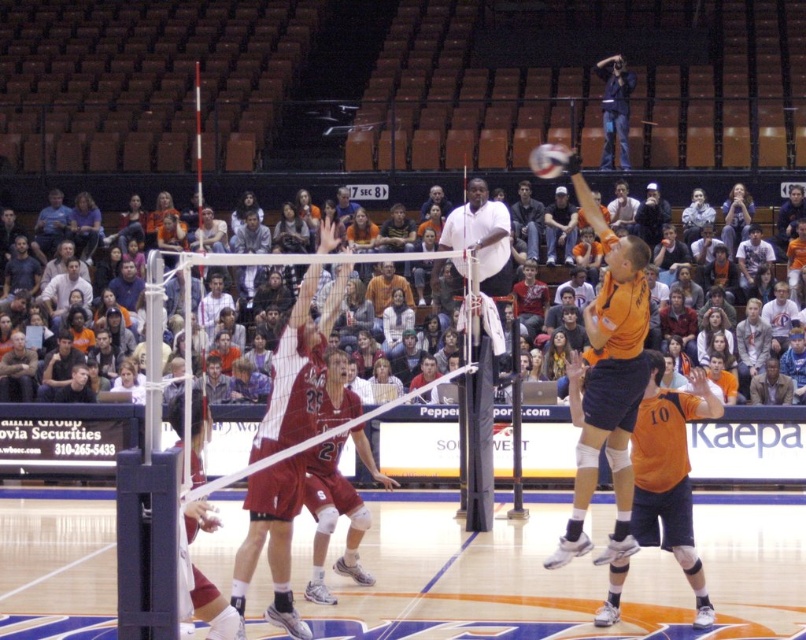
Is orange uniformed player at center further to camera compared to white matte volleyball at center?

Yes, it is.

Is orange uniformed player at center closer to the viewer compared to white matte volleyball at center?

No, it is behind white matte volleyball at center.

Identify the location of orange uniformed player at center. This screenshot has height=640, width=806. (559, 577).

Is orange casual clothing at upper center positioned before white matte volleyball at center?

That is False.

Is orange casual clothing at upper center positioned at the back of white matte volleyball at center?

Yes.

Between point (663, 184) and point (536, 148), which one is positioned in front?

Point (663, 184)

The image size is (806, 640). Identify the location of orange casual clothing at upper center. (323, 189).

Does orange uniformed player at center appear on the right side of orange casual clothing at upper center?

No, orange uniformed player at center is not to the right of orange casual clothing at upper center.

Is orange uniformed player at center shorter than orange casual clothing at upper center?

Correct, orange uniformed player at center is not as tall as orange casual clothing at upper center.

I want to click on orange uniformed player at center, so tap(559, 577).